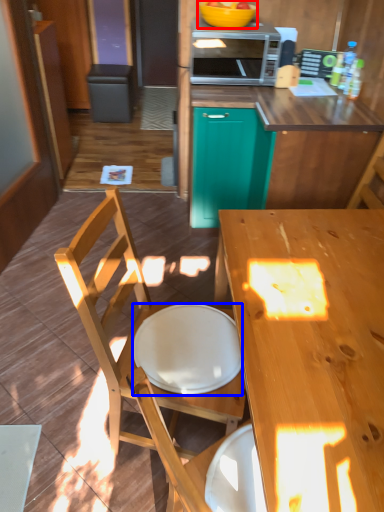
Question: Which object is closer to the camera taking this photo, bowl (highlighted by a red box) or plate (highlighted by a blue box)?

Choices:
 (A) bowl
 (B) plate

Answer: (B)